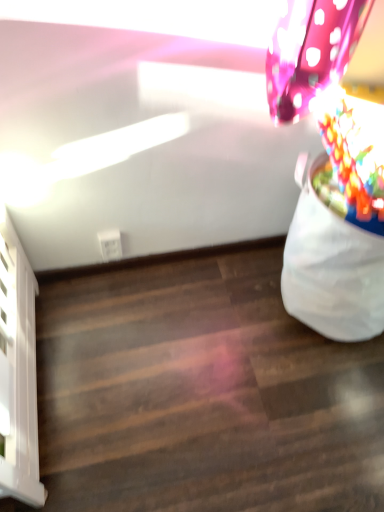
I want to click on vacant region in front of white fabric bean bag at right, so coord(308,402).